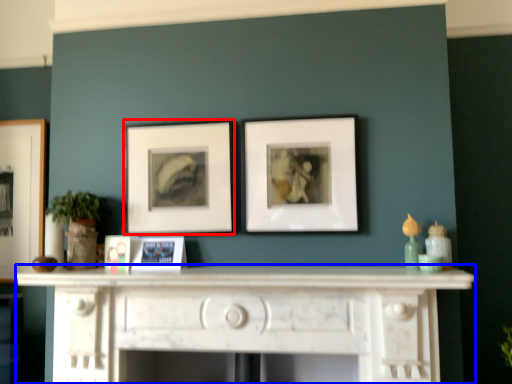
Question: Which of the following is the closest to the observer, picture frame (highlighted by a red box) or table (highlighted by a blue box)?

Choices:
 (A) picture frame
 (B) table

Answer: (B)